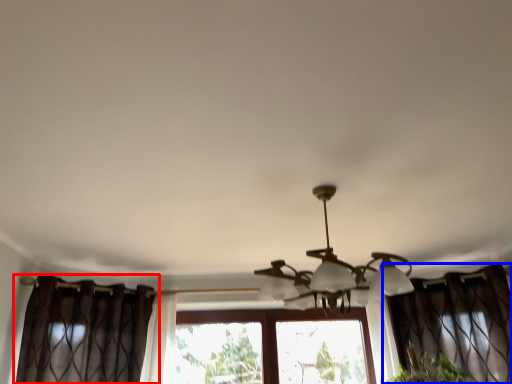
Question: Which point is further to the camera, curtain (highlighted by a red box) or curtain (highlighted by a blue box)?

Choices:
 (A) curtain
 (B) curtain

Answer: (B)